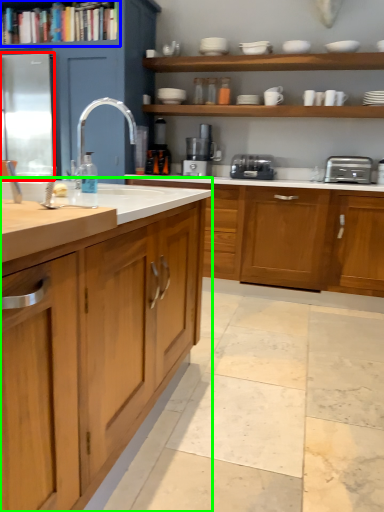
Question: Which object is the closest to the glass door (highlighted by a red box)? Choose among these: shelf (highlighted by a blue box) or countertop (highlighted by a green box).

Choices:
 (A) shelf
 (B) countertop

Answer: (A)